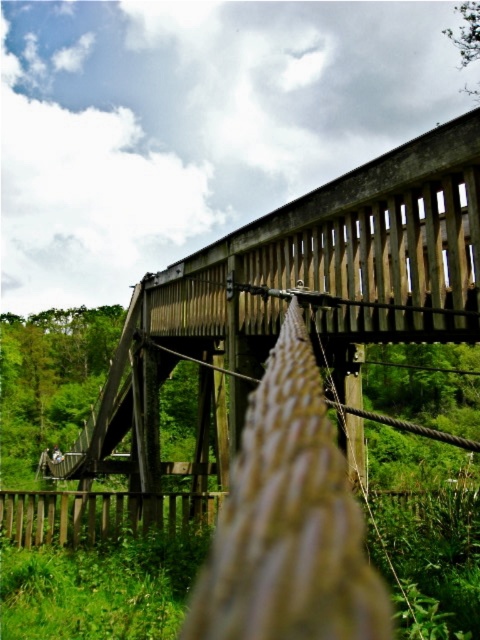
You are standing on the wooden bridge at center and want to see the brown wooden fence at lower center. In which direction should you look relative to your current position?

The wooden bridge at center is below the brown wooden fence at lower center, so you should look upward to see the brown wooden fence at lower center.

You are standing on the rustic wooden bridge and want to determine which of the two points, point [93,509] or point [217,502], is nearer to you. Based on the coordinates provided, which point is closer?

Point [93,509] is closer to the viewer than point [217,502].